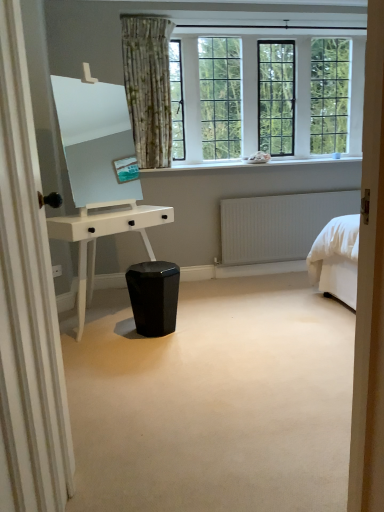
The height and width of the screenshot is (512, 384). I want to click on free space above clear glass windows at upper center (from a real-world perspective), so click(x=259, y=22).